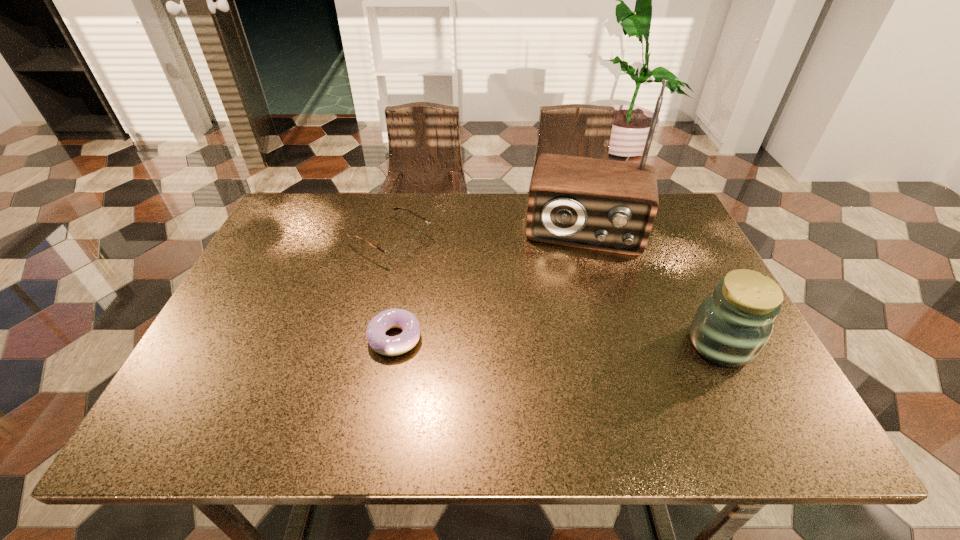
Where is `vacant space on the desktop that is between the shortest object and the second tallest object and is positioned on the front-facing side of the tallest object`? vacant space on the desktop that is between the shortest object and the second tallest object and is positioned on the front-facing side of the tallest object is located at coordinates (573, 341).

I want to click on vacant space on the desktop that is between the shortest object and the third shortest object and is positioned on the front-facing side of the second shortest object, so click(x=568, y=341).